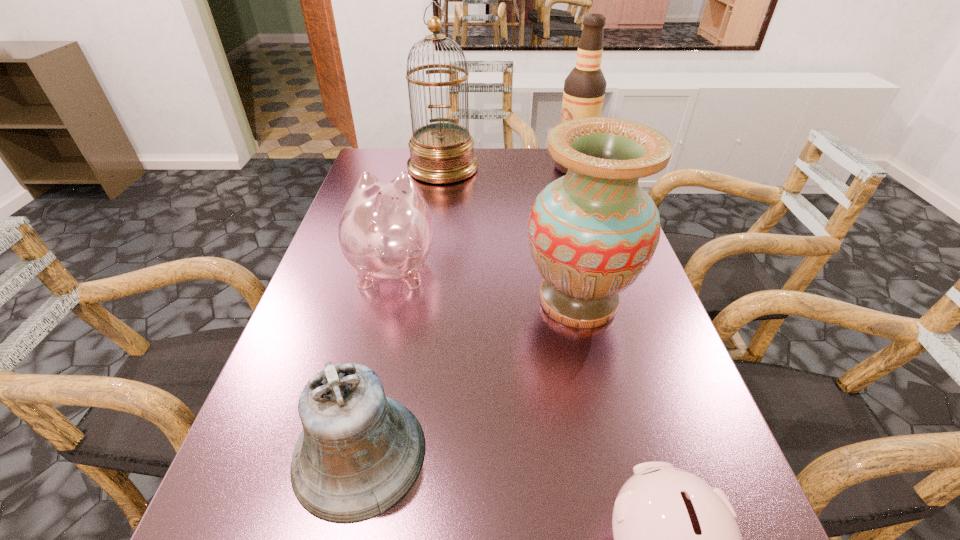
Image resolution: width=960 pixels, height=540 pixels. Identify the location of free space located on the front of the third tallest object. (623, 487).

The width and height of the screenshot is (960, 540). In order to click on free spot located 0.070m on the front facing side of the taller piggy bank in this screenshot , I will do `click(404, 220)`.

Locate an element on the screen. Image resolution: width=960 pixels, height=540 pixels. vacant region located 0.190m on the front facing side of the taller piggy bank is located at coordinates (410, 196).

You are a GUI agent. You are given a task and a screenshot of the screen. Output one action in this format:
    pyautogui.click(x=<x>, y=<y>)
    Task: Click on the free region located on the front facing side of the taller piggy bank
    
    Given the screenshot: What is the action you would take?
    pyautogui.click(x=405, y=215)

Find the location of `vacant space located on the right of the bell`. vacant space located on the right of the bell is located at coordinates (675, 453).

Image resolution: width=960 pixels, height=540 pixels. I want to click on birdcage present at the far edge, so click(x=440, y=152).

This screenshot has height=540, width=960. Find the location of `alcohol located in the far edge section of the desktop`. alcohol located in the far edge section of the desktop is located at coordinates (584, 88).

You are a GUI agent. You are given a task and a screenshot of the screen. Output one action in this format:
    pyautogui.click(x=<x>, y=<y>)
    Task: Click on the birdcage located in the left edge section of the desktop
    The image size is (960, 540).
    Given the screenshot: What is the action you would take?
    pyautogui.click(x=440, y=152)

Where is `piggy bank that is at the left edge`? This screenshot has width=960, height=540. piggy bank that is at the left edge is located at coordinates (386, 229).

Image resolution: width=960 pixels, height=540 pixels. I want to click on bell that is at the left edge, so click(360, 452).